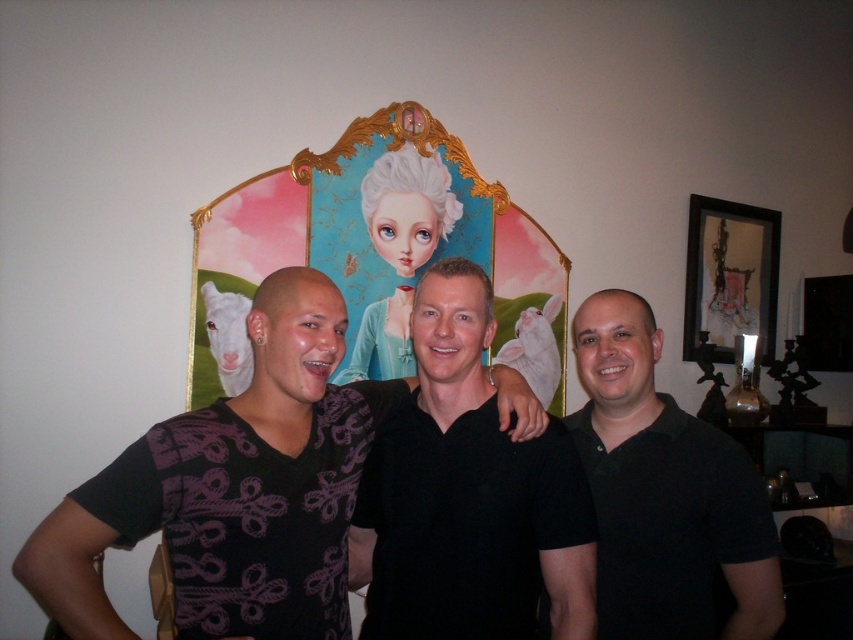
Question: Which object is positioned closest to the black matte shirt at right?

Choices:
 (A) black matte shirt at center
 (B) purple printed shirt at center
 (C) matte black picture frame at upper right

Answer: (A)

Question: Which point is closer to the camera?

Choices:
 (A) black matte shirt at right
 (B) matte black picture frame at upper right
 (C) black matte shirt at center

Answer: (C)

Question: Can you confirm if black matte shirt at center is thinner than matte black picture frame at upper right?

Choices:
 (A) no
 (B) yes

Answer: (B)

Question: Considering the real-world distances, which object is closest to the matte black picture frame at upper right?

Choices:
 (A) black matte shirt at right
 (B) black matte shirt at center
 (C) purple printed shirt at center

Answer: (A)

Question: Can you confirm if black matte shirt at right is thinner than matte black picture frame at upper right?

Choices:
 (A) no
 (B) yes

Answer: (B)

Question: Does black matte shirt at center appear on the left side of matte black picture frame at upper right?

Choices:
 (A) no
 (B) yes

Answer: (B)